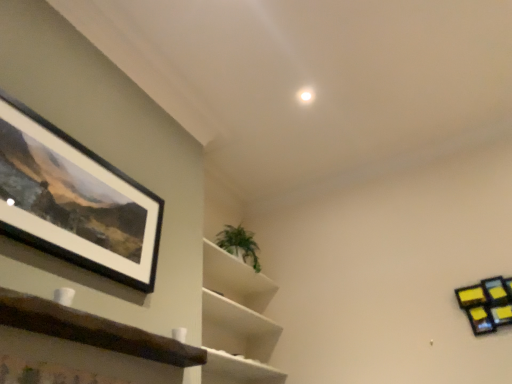
I want to click on green leafy plant at upper center, so click(239, 244).

This screenshot has width=512, height=384. In order to click on yellow sticky notes at upper right, the first shelf from the right in this screenshot , I will do `click(487, 304)`.

This screenshot has height=384, width=512. I want to click on black matte picture frame at upper left, so click(75, 200).

From a real-world perspective, which object rests below the other?

brown wooden shelf at lower left, the third shelf in the right-to-left sequence, from a real-world perspective.

Is brown wooden shelf at lower left, the third shelf in the right-to-left sequence, looking in the opposite direction of yellow sticky notes at upper right, which is counted as the 1th shelf, starting from the back?

No, brown wooden shelf at lower left, the third shelf in the right-to-left sequence,'s orientation is not away from yellow sticky notes at upper right, which is counted as the 1th shelf, starting from the back.

Is brown wooden shelf at lower left, the first shelf viewed from the left, completely or partially outside of yellow sticky notes at upper right, which is the 3th shelf in front-to-back order?

That's correct, brown wooden shelf at lower left, the first shelf viewed from the left, is outside of yellow sticky notes at upper right, which is the 3th shelf in front-to-back order.

From a real-world perspective, between brown wooden shelf at lower left, marked as the third shelf in a back-to-front arrangement, and green leafy plant at center, the second shelf positioned from the left, who is vertically lower?

brown wooden shelf at lower left, marked as the third shelf in a back-to-front arrangement, from a real-world perspective.

Is brown wooden shelf at lower left, marked as the third shelf in a back-to-front arrangement, looking in the opposite direction of green leafy plant at center, marked as the second shelf in a right-to-left arrangement?

No, brown wooden shelf at lower left, marked as the third shelf in a back-to-front arrangement, is not facing away from green leafy plant at center, marked as the second shelf in a right-to-left arrangement.

Can you confirm if brown wooden shelf at lower left, the third shelf in the right-to-left sequence, is shorter than green leafy plant at center, positioned as the 2th shelf in front-to-back order?

Indeed, brown wooden shelf at lower left, the third shelf in the right-to-left sequence, has a lesser height compared to green leafy plant at center, positioned as the 2th shelf in front-to-back order.

Looking at this image, which of these two, black matte picture frame at upper left or green leafy plant at upper center, is bigger?

Bigger between the two is green leafy plant at upper center.

From the image's perspective, is black matte picture frame at upper left over green leafy plant at upper center?

Correct, black matte picture frame at upper left appears higher than green leafy plant at upper center in the image.

Is black matte picture frame at upper left closer to the viewer compared to green leafy plant at upper center?

Yes.

Could green leafy plant at upper center be considered to be inside black matte picture frame at upper left?

No, green leafy plant at upper center is not inside black matte picture frame at upper left.

In the image, is green leafy plant at upper center positioned in front of or behind green leafy plant at center, the second shelf positioned from the left?

Visually, green leafy plant at upper center is located behind green leafy plant at center, the second shelf positioned from the left.

In terms of height, does green leafy plant at upper center look taller or shorter compared to green leafy plant at center, marked as the second shelf in a right-to-left arrangement?

green leafy plant at upper center is shorter than green leafy plant at center, marked as the second shelf in a right-to-left arrangement.

Based on the photo, is green leafy plant at upper center spatially inside green leafy plant at center, marked as the second shelf in a right-to-left arrangement, or outside of it?

green leafy plant at upper center is not enclosed by green leafy plant at center, marked as the second shelf in a right-to-left arrangement.

From a real-world perspective, does green leafy plant at upper center stand above green leafy plant at center, positioned as the 2th shelf in front-to-back order?

Correct, in the physical world, green leafy plant at upper center is higher than green leafy plant at center, positioned as the 2th shelf in front-to-back order.

From a real-world perspective, which is physically below, yellow sticky notes at upper right, which is counted as the 1th shelf, starting from the back, or black matte picture frame at upper left?

In real-world perspective, yellow sticky notes at upper right, which is counted as the 1th shelf, starting from the back, is lower.

Does point (463, 304) lie in front of point (19, 218)?

No, (463, 304) is behind (19, 218).

Can you tell me how much yellow sticky notes at upper right, the first shelf from the right, and black matte picture frame at upper left differ in facing direction?

yellow sticky notes at upper right, the first shelf from the right, and black matte picture frame at upper left are facing 90.3 degrees away from each other.

Is yellow sticky notes at upper right, which is counted as the 1th shelf, starting from the back, completely or partially outside of black matte picture frame at upper left?

Yes, yellow sticky notes at upper right, which is counted as the 1th shelf, starting from the back, is located beyond the bounds of black matte picture frame at upper left.

Considering the relative sizes of black matte picture frame at upper left and yellow sticky notes at upper right, which is counted as the 1th shelf, starting from the back, in the image provided, is black matte picture frame at upper left bigger than yellow sticky notes at upper right, which is counted as the 1th shelf, starting from the back,?

Indeed, black matte picture frame at upper left has a larger size compared to yellow sticky notes at upper right, which is counted as the 1th shelf, starting from the back.

Looking at this image, is black matte picture frame at upper left facing towards yellow sticky notes at upper right, the third shelf viewed from the left?

No, black matte picture frame at upper left is not facing towards yellow sticky notes at upper right, the third shelf viewed from the left.

Is yellow sticky notes at upper right, the third shelf viewed from the left, inside black matte picture frame at upper left?

No.

You are a GUI agent. You are given a task and a screenshot of the screen. Output one action in this format:
    pyautogui.click(x=<x>, y=<y>)
    Task: Click on the shelf that is the 2nd object directly below the black matte picture frame at upper left (from a real-world perspective)
    
    Given the screenshot: What is the action you would take?
    pyautogui.click(x=487, y=304)

From a real-world perspective, between green leafy plant at center, marked as the second shelf in a right-to-left arrangement, and green leafy plant at upper center, who is vertically higher?

From a 3D spatial view, green leafy plant at upper center is above.

From the image's perspective, between green leafy plant at center, the second shelf positioned from the left, and green leafy plant at upper center, which one is located above?

green leafy plant at upper center, from the image's perspective.

Can we say green leafy plant at center, which ranks as the 2th shelf in back-to-front order, lies outside green leafy plant at upper center?

Yes, green leafy plant at center, which ranks as the 2th shelf in back-to-front order, is not within green leafy plant at upper center.

Is point (233, 310) positioned after point (243, 241)?

No, (233, 310) is closer to viewer.

At what (x,y) coordinates should I click in order to perform the action: click on shelf below the yellow sticky notes at upper right, the third shelf viewed from the left (from a real-world perspective). Please return your answer as a coordinate pair (x, y). The image size is (512, 384). Looking at the image, I should click on (96, 335).

The height and width of the screenshot is (384, 512). Find the location of `shelf that appears in front of the green leafy plant at center, marked as the second shelf in a right-to-left arrangement`. shelf that appears in front of the green leafy plant at center, marked as the second shelf in a right-to-left arrangement is located at coordinates (96, 335).

Based on their spatial positions, is green leafy plant at upper center or black matte picture frame at upper left further from green leafy plant at center, which ranks as the 2th shelf in back-to-front order?

black matte picture frame at upper left.

When comparing their distances from green leafy plant at center, positioned as the 2th shelf in front-to-back order, does black matte picture frame at upper left or yellow sticky notes at upper right, which is the 3th shelf in front-to-back order, seem further?

Based on the image, yellow sticky notes at upper right, which is the 3th shelf in front-to-back order, appears to be further to green leafy plant at center, positioned as the 2th shelf in front-to-back order.

Looking at the image, which one is located further to black matte picture frame at upper left, yellow sticky notes at upper right, which is the 3th shelf in front-to-back order, or green leafy plant at center, which ranks as the 2th shelf in back-to-front order?

The object further to black matte picture frame at upper left is yellow sticky notes at upper right, which is the 3th shelf in front-to-back order.

Estimate the real-world distances between objects in this image. Which object is further from black matte picture frame at upper left, brown wooden shelf at lower left, the third shelf in the right-to-left sequence, or green leafy plant at upper center?

The object further to black matte picture frame at upper left is green leafy plant at upper center.

Which object lies further to the anchor point black matte picture frame at upper left, green leafy plant at upper center or brown wooden shelf at lower left, positioned as the 1th shelf in front-to-back order?

Based on the image, green leafy plant at upper center appears to be further to black matte picture frame at upper left.

When comparing their distances from black matte picture frame at upper left, does green leafy plant at center, which ranks as the 2th shelf in back-to-front order, or brown wooden shelf at lower left, the third shelf in the right-to-left sequence, seem further?

Based on the image, green leafy plant at center, which ranks as the 2th shelf in back-to-front order, appears to be further to black matte picture frame at upper left.

Estimate the real-world distances between objects in this image. Which object is further from yellow sticky notes at upper right, the third shelf viewed from the left, brown wooden shelf at lower left, the first shelf viewed from the left, or green leafy plant at center, positioned as the 2th shelf in front-to-back order?

Based on the image, brown wooden shelf at lower left, the first shelf viewed from the left, appears to be further to yellow sticky notes at upper right, the third shelf viewed from the left.

Which object lies nearer to the anchor point green leafy plant at center, the second shelf positioned from the left, brown wooden shelf at lower left, positioned as the 1th shelf in front-to-back order, or yellow sticky notes at upper right, the first shelf from the right?

brown wooden shelf at lower left, positioned as the 1th shelf in front-to-back order, is closer to green leafy plant at center, the second shelf positioned from the left.

This screenshot has width=512, height=384. Find the location of `picture frame positioned between brown wooden shelf at lower left, marked as the third shelf in a back-to-front arrangement, and green leafy plant at center, marked as the second shelf in a right-to-left arrangement, from near to far`. picture frame positioned between brown wooden shelf at lower left, marked as the third shelf in a back-to-front arrangement, and green leafy plant at center, marked as the second shelf in a right-to-left arrangement, from near to far is located at coordinates (75, 200).

The image size is (512, 384). In order to click on houseplant located between black matte picture frame at upper left and yellow sticky notes at upper right, which is the 3th shelf in front-to-back order, in the left-right direction in this screenshot , I will do `click(239, 244)`.

Image resolution: width=512 pixels, height=384 pixels. What are the coordinates of `picture frame positioned between brown wooden shelf at lower left, marked as the third shelf in a back-to-front arrangement, and green leafy plant at upper center from near to far` in the screenshot? It's located at (75, 200).

Where is `houseplant between green leafy plant at center, positioned as the 2th shelf in front-to-back order, and yellow sticky notes at upper right, which is the 3th shelf in front-to-back order, in the horizontal direction`? This screenshot has width=512, height=384. houseplant between green leafy plant at center, positioned as the 2th shelf in front-to-back order, and yellow sticky notes at upper right, which is the 3th shelf in front-to-back order, in the horizontal direction is located at coordinates (239, 244).